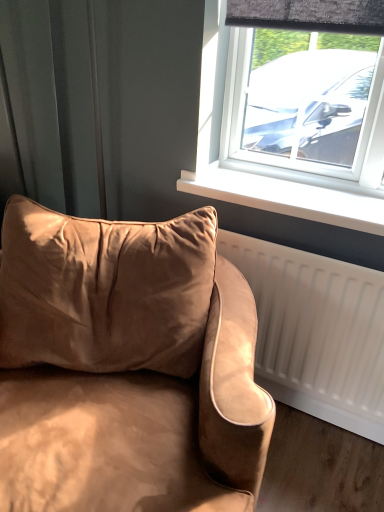
Question: In the image, is suede-like beige couch at lower left positioned in front of or behind white plastic window sill at center?

Choices:
 (A) front
 (B) behind

Answer: (A)

Question: In terms of height, does suede-like beige couch at lower left look taller or shorter compared to white plastic window sill at center?

Choices:
 (A) short
 (B) tall

Answer: (B)

Question: Considering the relative positions of suede-like beige couch at lower left and white plastic window sill at center in the image provided, is suede-like beige couch at lower left to the left or to the right of white plastic window sill at center?

Choices:
 (A) left
 (B) right

Answer: (A)

Question: Considering the positions of white plastic window sill at center and suede-like beige couch at lower left in the image, is white plastic window sill at center wider or thinner than suede-like beige couch at lower left?

Choices:
 (A) thin
 (B) wide

Answer: (A)

Question: From their relative heights in the image, would you say white plastic window sill at center is taller or shorter than suede-like beige couch at lower left?

Choices:
 (A) tall
 (B) short

Answer: (B)

Question: In the image, is white plastic window sill at center positioned in front of or behind suede-like beige couch at lower left?

Choices:
 (A) front
 (B) behind

Answer: (B)

Question: From the image's perspective, relative to suede-like beige couch at lower left, is white plastic window sill at center above or below?

Choices:
 (A) below
 (B) above

Answer: (B)